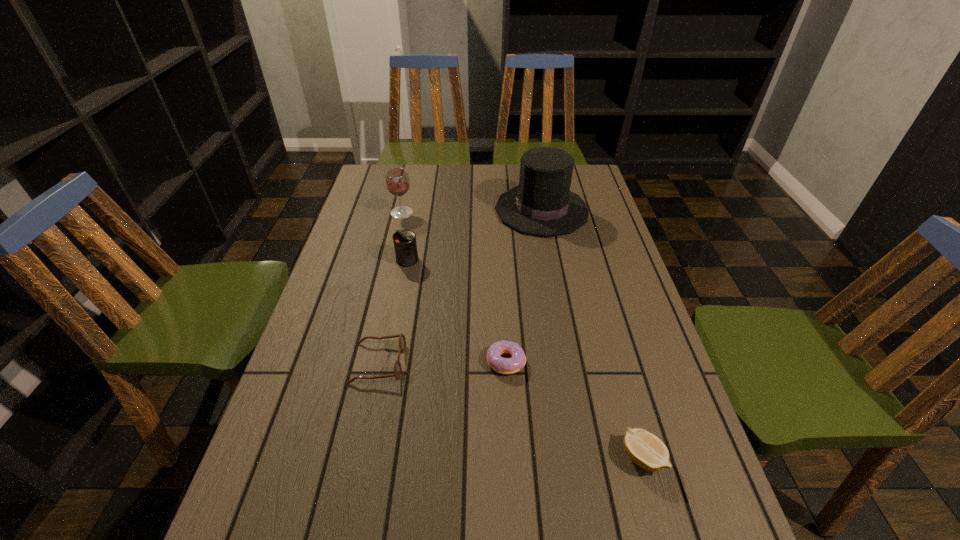
Locate an element on the screen. The width and height of the screenshot is (960, 540). unoccupied position between the spectacles and the third tallest object is located at coordinates (393, 311).

Find the location of a particular element. free space that is in between the third farthest object and the doughnut is located at coordinates (457, 310).

Identify the location of free space between the third tallest object and the spectacles. (393, 311).

You are a GUI agent. You are given a task and a screenshot of the screen. Output one action in this format:
    pyautogui.click(x=<x>, y=<y>)
    Task: Click on the empty space between the fourth nearest object and the dress hat
    
    Given the screenshot: What is the action you would take?
    pyautogui.click(x=474, y=235)

Select which object appears as the fourth closest to the tallest object. Please provide its 2D coordinates. Your answer should be formatted as a tuple, i.e. [(x, y)], where the tuple contains the x and y coordinates of a point satisfying the conditions above.

[(402, 341)]

Select which object is the closest to the spectacles. Please provide its 2D coordinates. Your answer should be formatted as a tuple, i.e. [(x, y)], where the tuple contains the x and y coordinates of a point satisfying the conditions above.

[(507, 366)]

This screenshot has width=960, height=540. I want to click on vacant space that satisfies the following two spatial constraints: 1. on the front-facing side of the lemon; 2. on the left side of the spectacles, so click(358, 457).